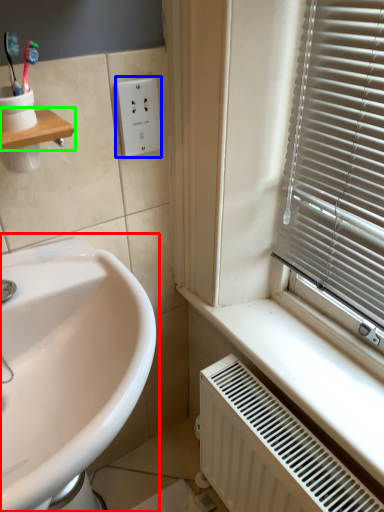
Question: Estimate the real-world distances between objects in this image. Which object is closer to sink (highlighted by a red box), electric outlet (highlighted by a blue box) or window sill (highlighted by a green box)?

Choices:
 (A) electric outlet
 (B) window sill

Answer: (B)